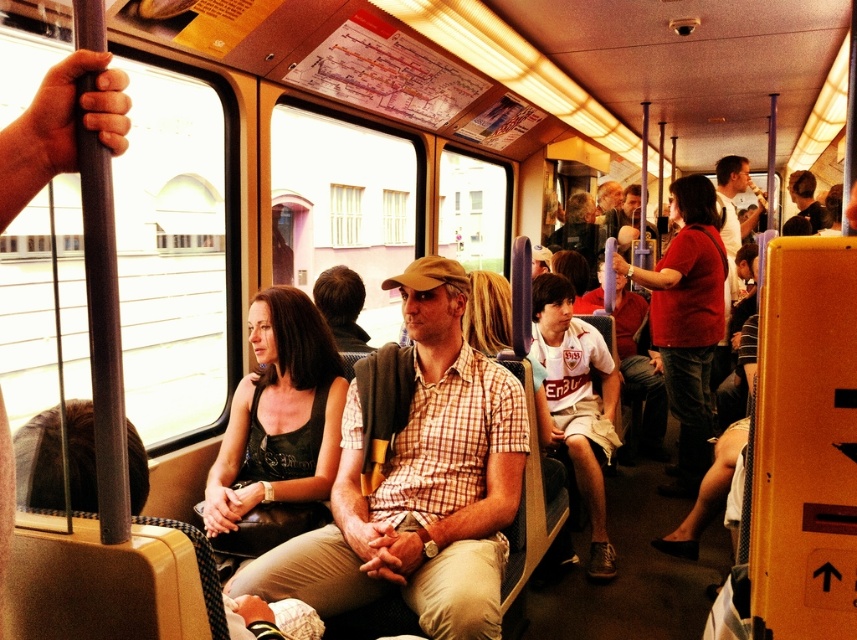
Who is more forward, [428,564] or [588,433]?

Point [428,564] is more forward.

Who is shorter, plaid cotton shirt at center or white cotton shirt at center?

With less height is plaid cotton shirt at center.

Is point (424, 364) positioned in front of point (562, 388)?

Yes, point (424, 364) is closer to viewer.

Find the location of a particular element. The image size is (857, 640). plaid cotton shirt at center is located at coordinates (418, 484).

Is point (592, 522) closer to camera compared to point (634, 211)?

That is True.

Does white cotton shirt at center have a smaller size compared to matte brown cap at center?

Incorrect, white cotton shirt at center is not smaller in size than matte brown cap at center.

Which is in front, point (590, 348) or point (625, 220)?

Positioned in front is point (590, 348).

This screenshot has height=640, width=857. What are the coordinates of `white cotton shirt at center` in the screenshot? It's located at (577, 401).

Who is higher up, white cotton shirt at center or dark brown hair at upper right?

dark brown hair at upper right is above.

Is white cotton shirt at center further to the viewer compared to dark brown hair at upper right?

No.

The image size is (857, 640). I want to click on white cotton shirt at center, so 577,401.

The image size is (857, 640). I want to click on white cotton shirt at center, so click(577, 401).